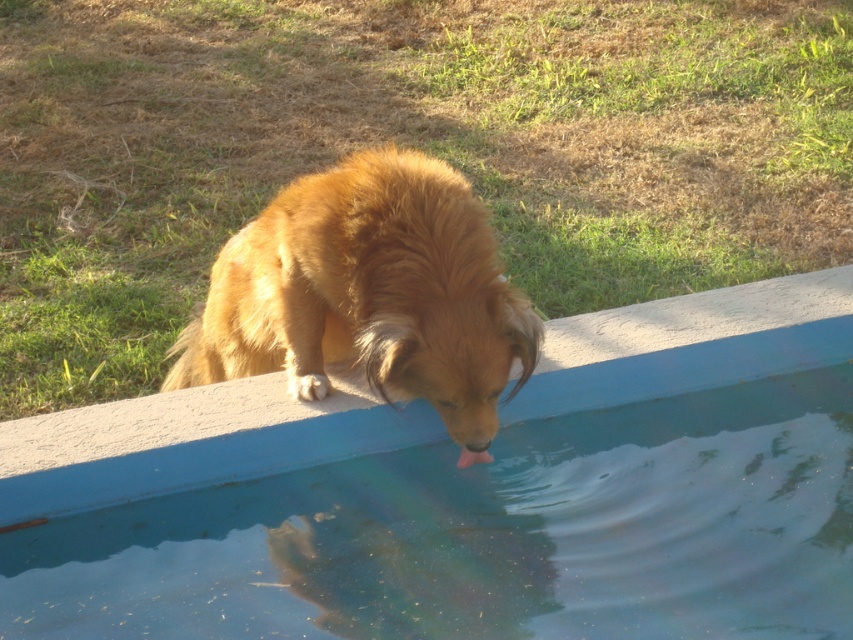
Is blue concrete swimming pool at lower center thinner than golden fur dog at lower center?

No.

Is blue concrete swimming pool at lower center above golden fur dog at lower center?

Incorrect, blue concrete swimming pool at lower center is not positioned above golden fur dog at lower center.

Which is behind, point (697, 556) or point (395, 298)?

Point (395, 298)

Find the location of `blue concrete swimming pool at lower center`. blue concrete swimming pool at lower center is located at coordinates (488, 536).